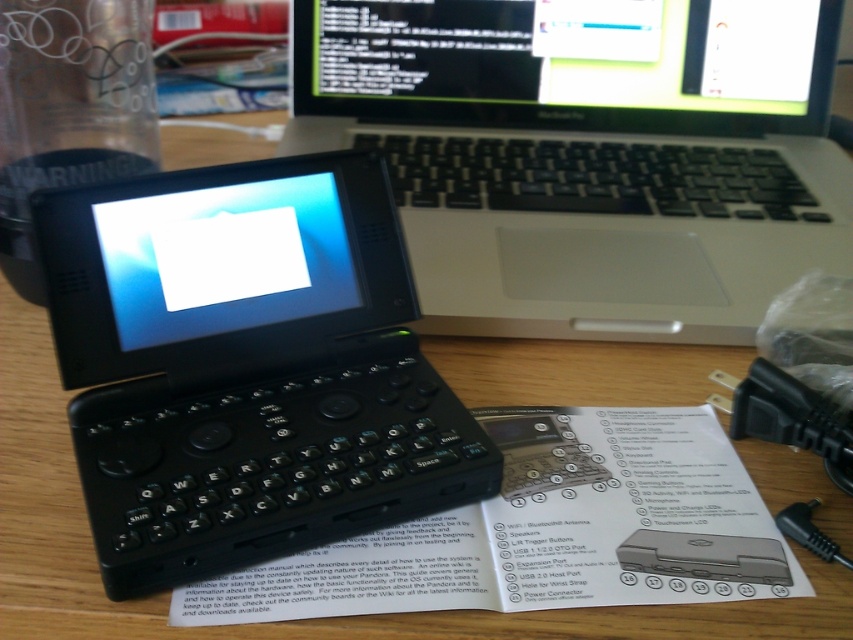
Who is more distant from viewer, (453, 529) or (641, 193)?

The point (641, 193) is behind.

Which is more to the right, white paper at center or black plastic keyboard at center?

From the viewer's perspective, black plastic keyboard at center appears more on the right side.

At what (x,y) coordinates should I click in order to perform the action: click on white paper at center. Please return your answer as a coordinate pair (x, y). The height and width of the screenshot is (640, 853). Looking at the image, I should click on (544, 531).

Who is more distant from viewer, (445, 170) or (440, 419)?

Point (445, 170)

Who is more distant from viewer, [485,230] or [102,502]?

The point [485,230] is more distant.

At what (x,y) coordinates should I click in order to perform the action: click on black plastic laptop at upper center. Please return your answer as a coordinate pair (x, y). Image resolution: width=853 pixels, height=640 pixels. Looking at the image, I should click on (589, 154).

Does black plastic laptop at upper center have a larger size compared to black plastic keyboard at center?

Yes.

Can you confirm if black plastic laptop at upper center is smaller than black plastic keyboard at center?

No.

The width and height of the screenshot is (853, 640). Identify the location of black plastic laptop at upper center. (589, 154).

The image size is (853, 640). In order to click on black plastic laptop at upper center in this screenshot , I will do `click(589, 154)`.